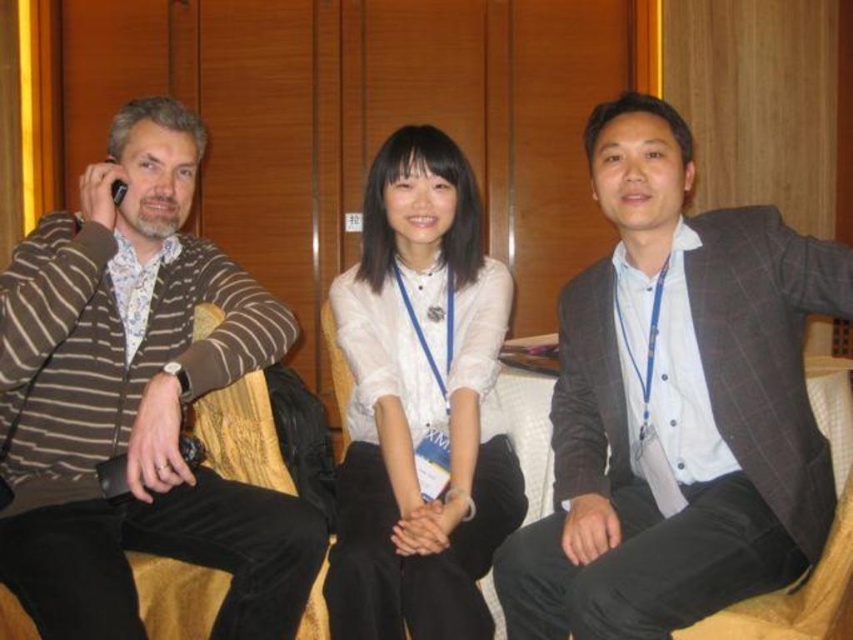
You are a tailor who needs to determine which garment requires more fabric between the brown striped sweater at left and the white matte shirt at center. Based on their sizes, which one would need more fabric?

The brown striped sweater at left is larger in size than the white matte shirt at center, so it would require more fabric.

You are a security guard in the building where this meeting is taking place. You need to ensure that all attendees are maintaining a minimum distance of 18 inches apart for safety protocols. Based on the scene, is the distance between the brown striped sweater at left and the white matte shirt at center compliant with the safety protocols?

The distance between the brown striped sweater at left and the white matte shirt at center is 16.42 inches, which is less than the required 18 inches. Therefore, they are not compliant with the safety protocols.

Based on the scene description, which object is shorter between the gray checkered suit at center and the white matte shirt at center?

The gray checkered suit at center is shorter than the white matte shirt at center.